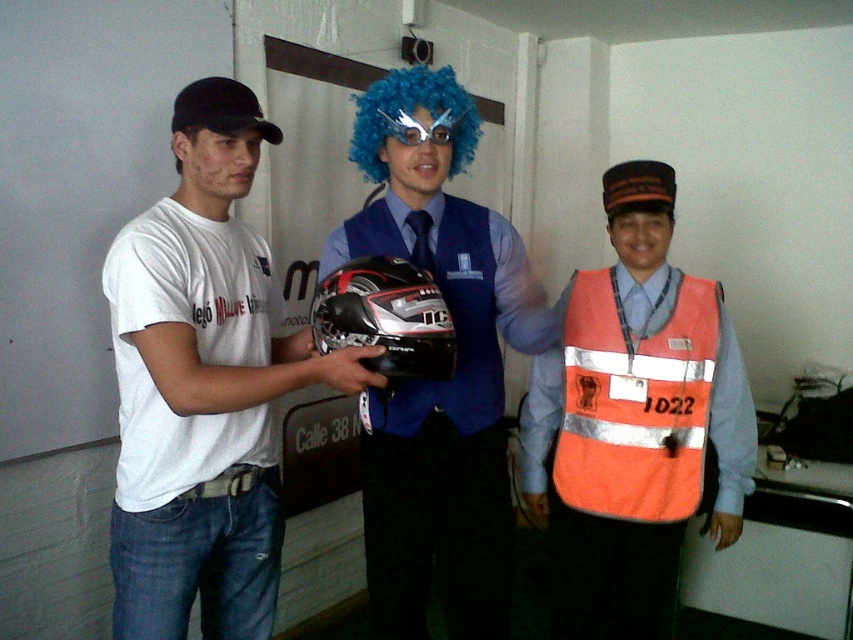
Question: Is white matte t-shirt at left positioned at the back of orange reflective safety vest at center?

Choices:
 (A) yes
 (B) no

Answer: (B)

Question: Considering the real-world distances, which object is closest to the glossy black helmet at center?

Choices:
 (A) orange reflective vest at center
 (B) orange reflective safety vest at center
 (C) white matte t-shirt at left
 (D) shiny black helmet at center

Answer: (D)

Question: Which point is closer to the camera?

Choices:
 (A) (433, 330)
 (B) (741, 477)

Answer: (A)

Question: Is white matte t-shirt at left further to camera compared to orange reflective vest at center?

Choices:
 (A) no
 (B) yes

Answer: (A)

Question: Which object is farther from the camera taking this photo?

Choices:
 (A) orange reflective vest at center
 (B) white matte t-shirt at left
 (C) glossy black helmet at center

Answer: (A)

Question: Is the position of orange reflective vest at center less distant than that of glossy black helmet at center?

Choices:
 (A) no
 (B) yes

Answer: (A)